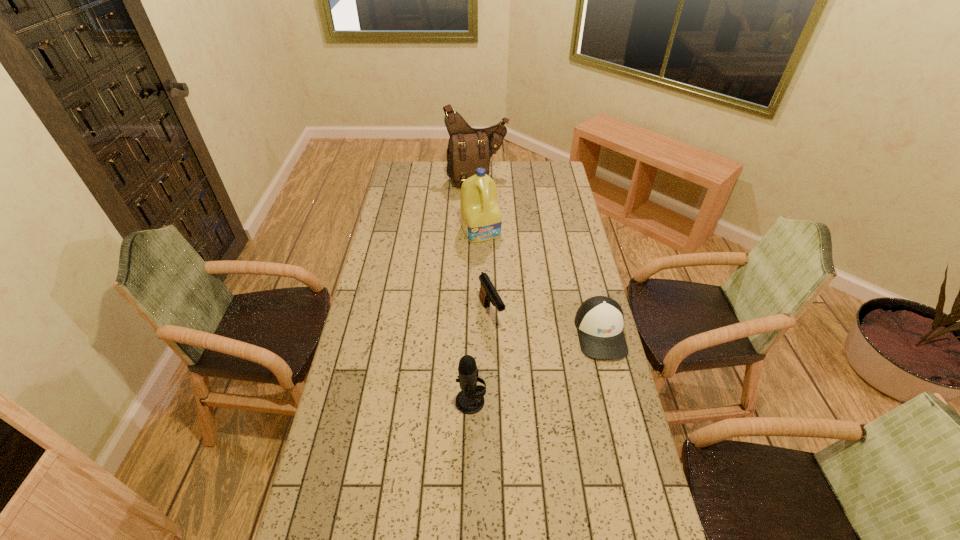
The width and height of the screenshot is (960, 540). I want to click on the nearest object, so click(x=470, y=400).

At what (x,y) coordinates should I click in order to perform the action: click on microphone. Please return your answer as a coordinate pair (x, y). Looking at the image, I should click on (470, 400).

Find the location of a particular element. the shortest object is located at coordinates (599, 320).

The image size is (960, 540). In order to click on the rightmost object in this screenshot , I will do `click(599, 320)`.

You are a GUI agent. You are given a task and a screenshot of the screen. Output one action in this format:
    pyautogui.click(x=<x>, y=<y>)
    Task: Click on the detergent
    The height and width of the screenshot is (540, 960).
    Given the screenshot: What is the action you would take?
    pyautogui.click(x=481, y=219)

Identify the location of the second farthest object. The width and height of the screenshot is (960, 540). (481, 219).

Locate an element on the screen. The height and width of the screenshot is (540, 960). pistol is located at coordinates (488, 293).

Where is `the farthest object`? The image size is (960, 540). the farthest object is located at coordinates (469, 148).

Locate an element on the screen. The width and height of the screenshot is (960, 540). the tallest object is located at coordinates (469, 148).

Locate an element on the screen. vacant space located on the front of the nearest object is located at coordinates (469, 473).